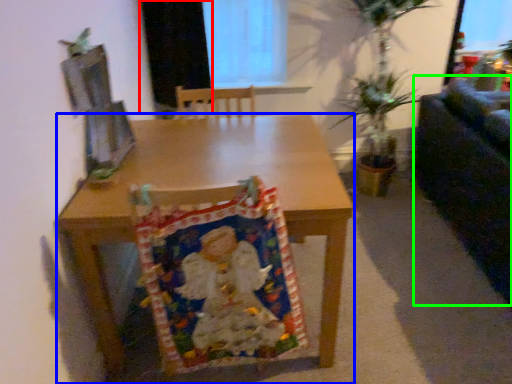
Question: Estimate the real-world distances between objects in this image. Which object is closer to curtain (highlighted by a red box), desk (highlighted by a blue box) or couch (highlighted by a green box)?

Choices:
 (A) desk
 (B) couch

Answer: (A)